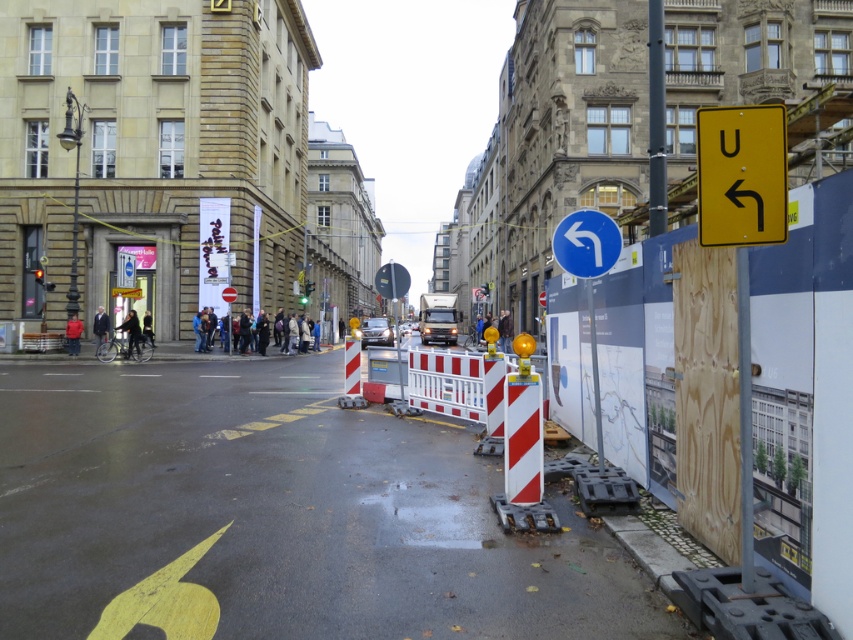
Based on the photo, you are a pedestrian trying to navigate through the construction area. You see the white striped barricade at center and the red fabric jacket at center. Which object is larger in size?

The white striped barricade at center is bigger than the red fabric jacket at center, so the barricade is larger in size.

You are a pedestrian standing on the street and see the metallic pole at upper right and the dark blue jacket at left. Which object is positioned higher relative to the other?

The metallic pole at upper right is located above the dark blue jacket at left, so it is positioned higher.

You are a pedestrian on the street and want to reach the subway entrance marked by the U Bahn sign. There is a white striped barricade at center and a red fabric jacket at center in your path. Which object should you move around to the left to avoid the construction area?

You should move around the red fabric jacket at center to the left since the white striped barricade at center is positioned to its right, indicating the barricade is further along the path and the jacket is closer to your current position.